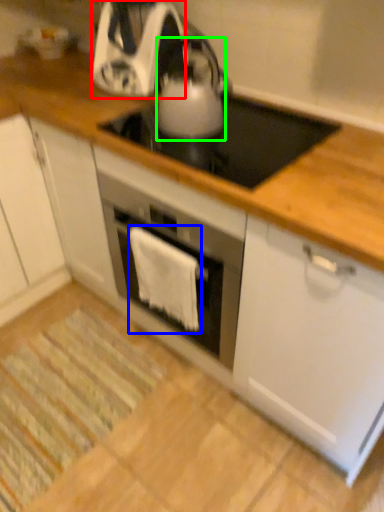
Question: Which is nearer to the kitchen appliance (highlighted by a red box)? cloth (highlighted by a blue box) or kitchen appliance (highlighted by a green box).

Choices:
 (A) cloth
 (B) kitchen appliance

Answer: (B)